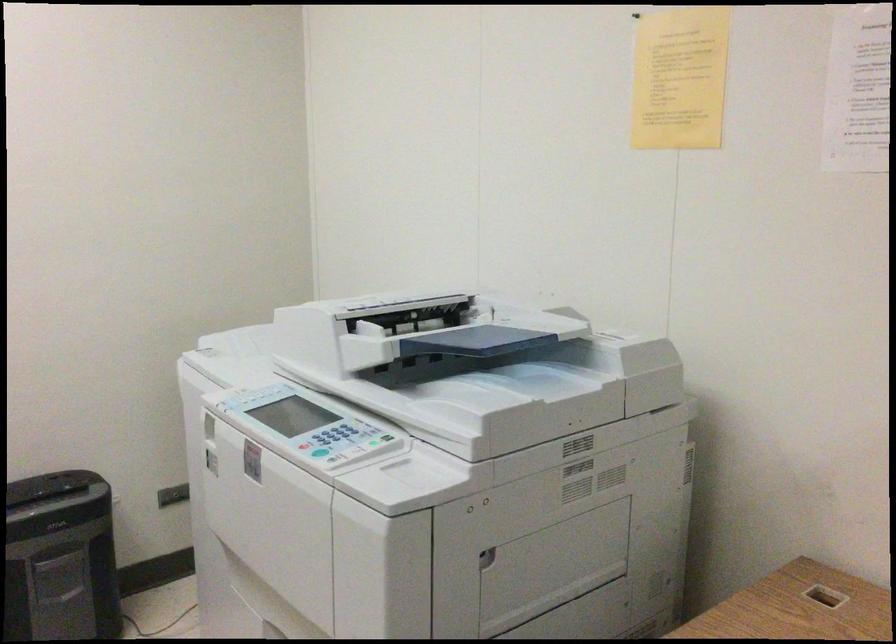
Find the location of a particular element. printer control button is located at coordinates (332, 438).